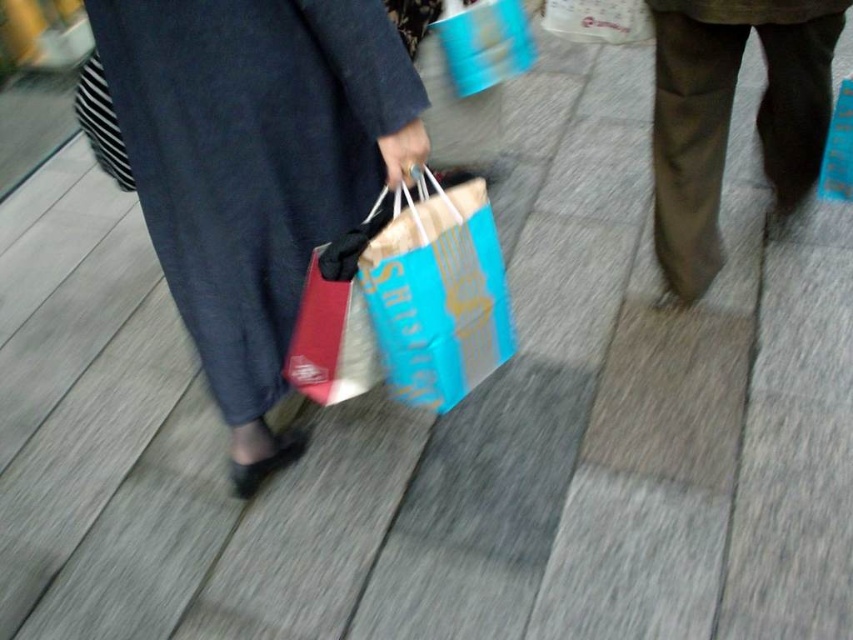
Does matte fabric dress at center have a greater width compared to blue paper bag at center?

Yes, matte fabric dress at center is wider than blue paper bag at center.

Between matte fabric dress at center and blue paper bag at center, which one is positioned higher?

matte fabric dress at center is higher up.

In order to click on matte fabric dress at center in this screenshot , I will do `click(248, 166)`.

Find the location of a particular element. The width and height of the screenshot is (853, 640). matte fabric dress at center is located at coordinates (248, 166).

Between dark brown pants at right and blue paper bag at center, which one has more height?

dark brown pants at right is taller.

Who is more distant from viewer, (x=767, y=125) or (x=425, y=337)?

The point (x=767, y=125) is behind.

Where is `dark brown pants at right`? dark brown pants at right is located at coordinates (730, 115).

Who is lower down, matte fabric dress at center or dark brown pants at right?

matte fabric dress at center is lower down.

Is matte fabric dress at center closer to camera compared to dark brown pants at right?

Yes, matte fabric dress at center is closer to the viewer.

Is point (125, 86) positioned in front of point (699, 276)?

Yes, point (125, 86) is in front of point (699, 276).

The width and height of the screenshot is (853, 640). I want to click on matte fabric dress at center, so click(248, 166).